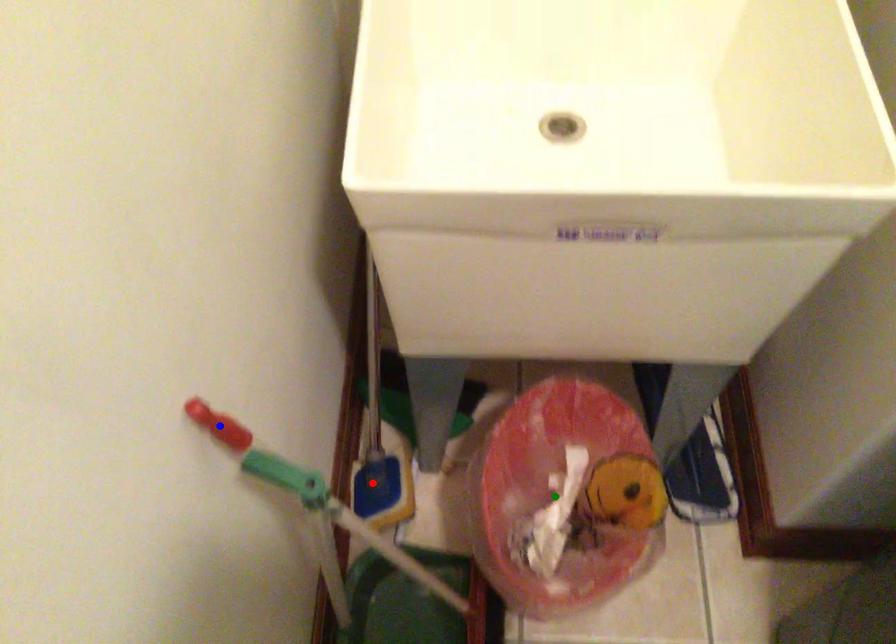
Order these from nearest to farthest:
green point | blue point | red point

red point, green point, blue point